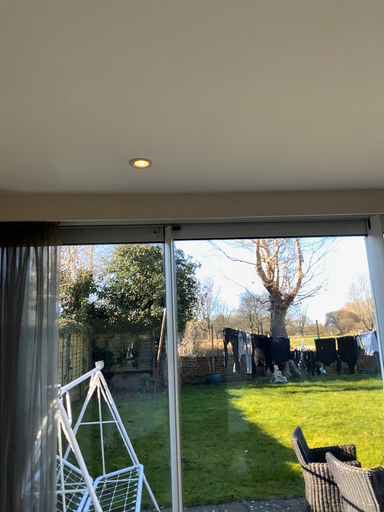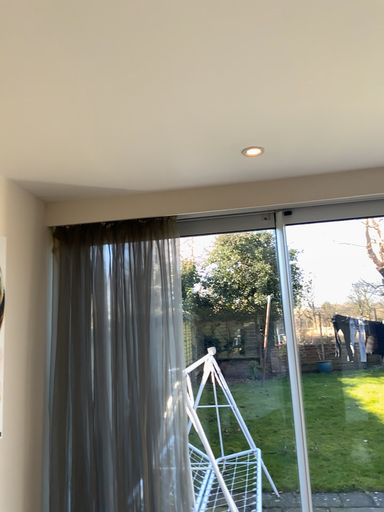
Question: Which way did the camera rotate in the video?

Choices:
 (A) rotated right
 (B) rotated left

Answer: (B)